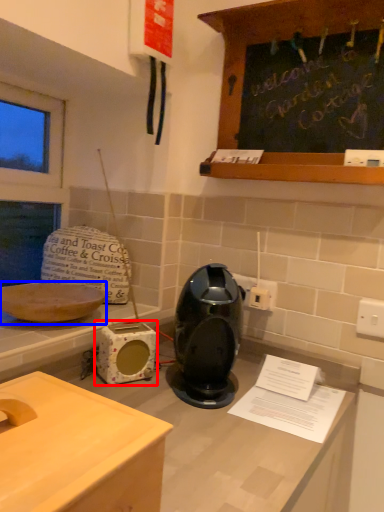
Question: Which of the following is the farthest to the observer, appliance (highlighted by a red box) or kitchen appliance (highlighted by a blue box)?

Choices:
 (A) appliance
 (B) kitchen appliance

Answer: (A)